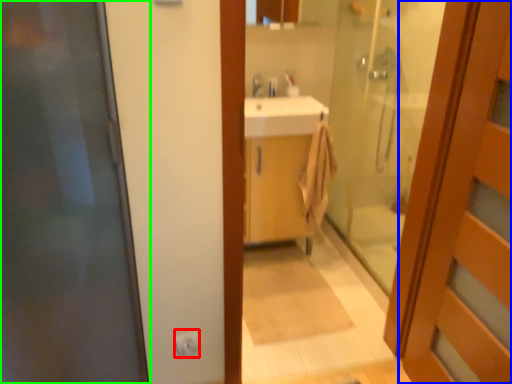
Question: Based on their relative distances, which object is farther from electric outlet (highlighted by a red box)? Choose from door (highlighted by a blue box) and door (highlighted by a green box).

Choices:
 (A) door
 (B) door

Answer: (A)